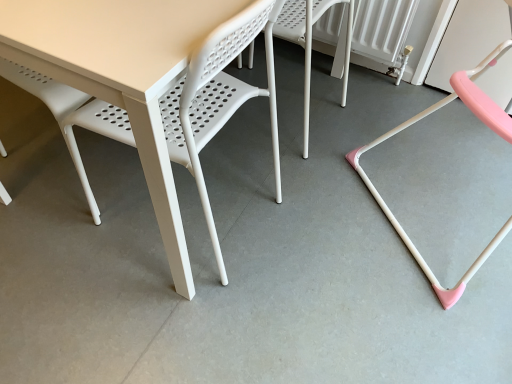
Find the location of `vacant region to the left of white plastic table at center`. vacant region to the left of white plastic table at center is located at coordinates (69, 214).